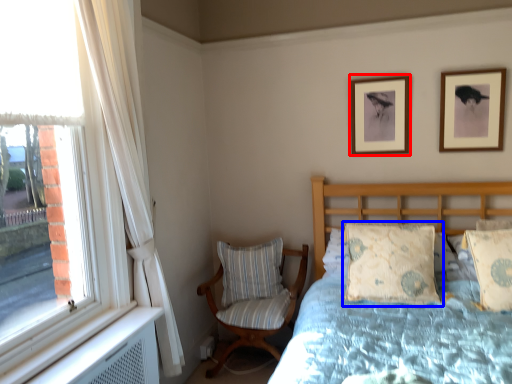
Question: Which of the following is the closest to the observer, picture frame (highlighted by a red box) or pillow (highlighted by a blue box)?

Choices:
 (A) picture frame
 (B) pillow

Answer: (B)